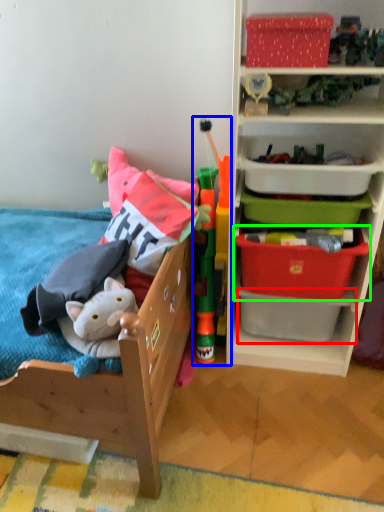
Question: Which is farther away from storage box (highlighted by a red box)? toy (highlighted by a blue box) or storage box (highlighted by a green box)?

Choices:
 (A) toy
 (B) storage box

Answer: (A)